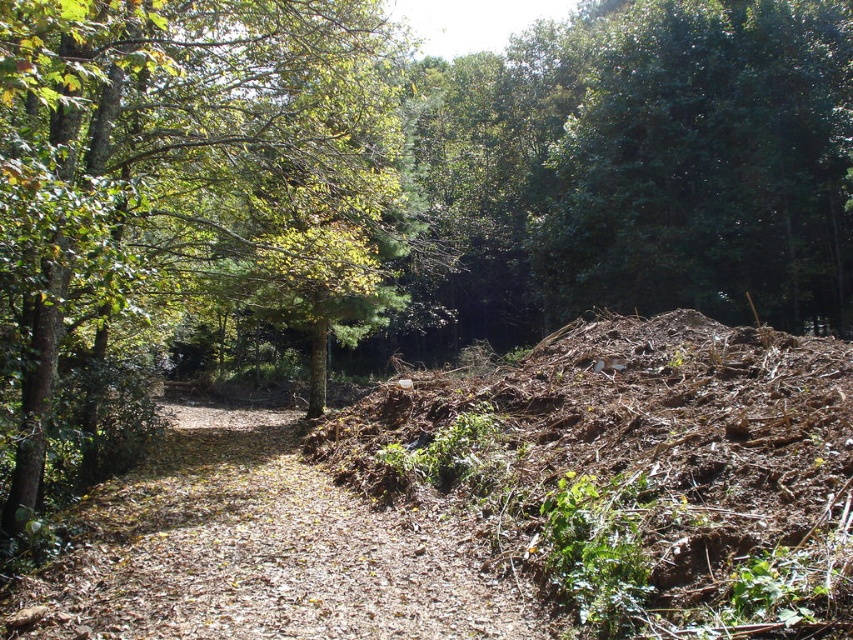
Question: Which point is farther to the camera?

Choices:
 (A) brown dirt track at center
 (B) green leafy tree at center

Answer: (A)

Question: Which point is farther to the camera?

Choices:
 (A) brown/dry soil at center
 (B) green leafy tree at center

Answer: (B)

Question: Where is green leafy tree at center located in relation to brown/dry soil at center in the image?

Choices:
 (A) left
 (B) right

Answer: (A)

Question: Can you confirm if brown/dry soil at center is bigger than brown dirt track at center?

Choices:
 (A) yes
 (B) no

Answer: (A)

Question: Based on their relative distances, which object is farther from the brown dirt track at center?

Choices:
 (A) green leafy tree at center
 (B) brown/dry soil at center

Answer: (A)

Question: Can you confirm if green leafy tree at center is smaller than brown dirt track at center?

Choices:
 (A) no
 (B) yes

Answer: (A)